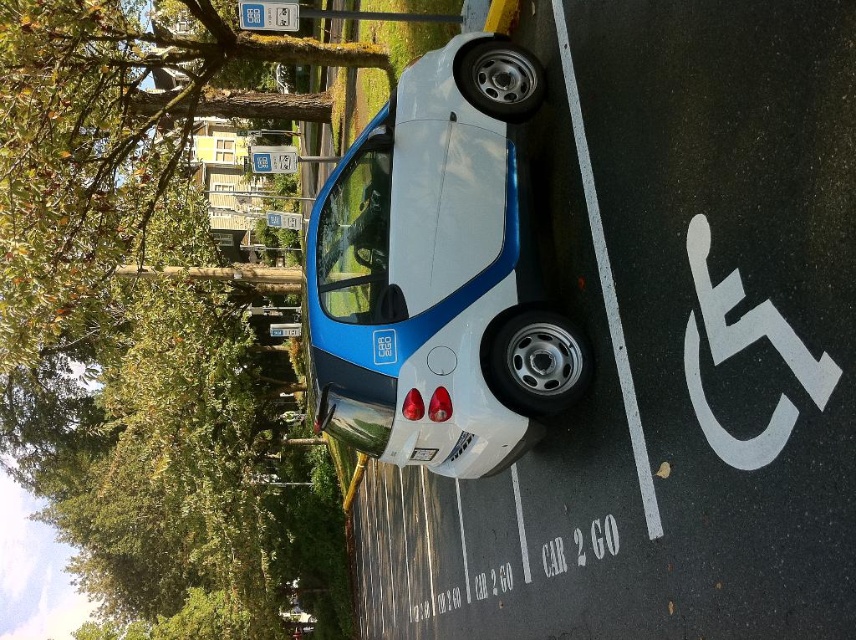
You are a parking attendant checking if the metallic blue car at center is properly parked within the designated parking space. Based on its 2D coordinates, can you confirm if it is centered in the parking space?

The metallic blue car at center is located at point (437,275), which indicates it is centered in the parking space.

You are a delivery driver who needs to park your van next to the metallic blue car at center and the white plastic parking sign at center. Considering their heights, which vehicle or object should you be cautious about when lowering your van to avoid collision?

The metallic blue car at center has a greater height compared to the white plastic parking sign at center, so you should be cautious about the metallic blue car at center when lowering your van to avoid collision.

You are a delivery person trying to park your van which is 6 meters long. You see the metallic blue car at center and the white plastic parking sign at center. Can your van fit in the parking space if the car is moved?

The metallic blue car at center is larger in size than the white plastic parking sign at center. Since your van is 6 meters long, you need to check the parking space dimensions. However, the provided information does not specify the size of the parking space or the car, so it is unclear if the van would fit after moving the car.